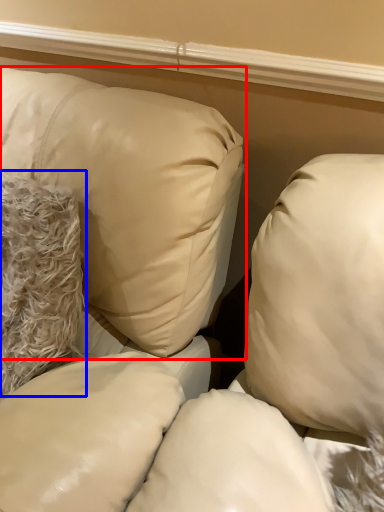
Question: Among these objects, which one is farthest to the camera, pillow (highlighted by a red box) or pillow (highlighted by a blue box)?

Choices:
 (A) pillow
 (B) pillow

Answer: (B)